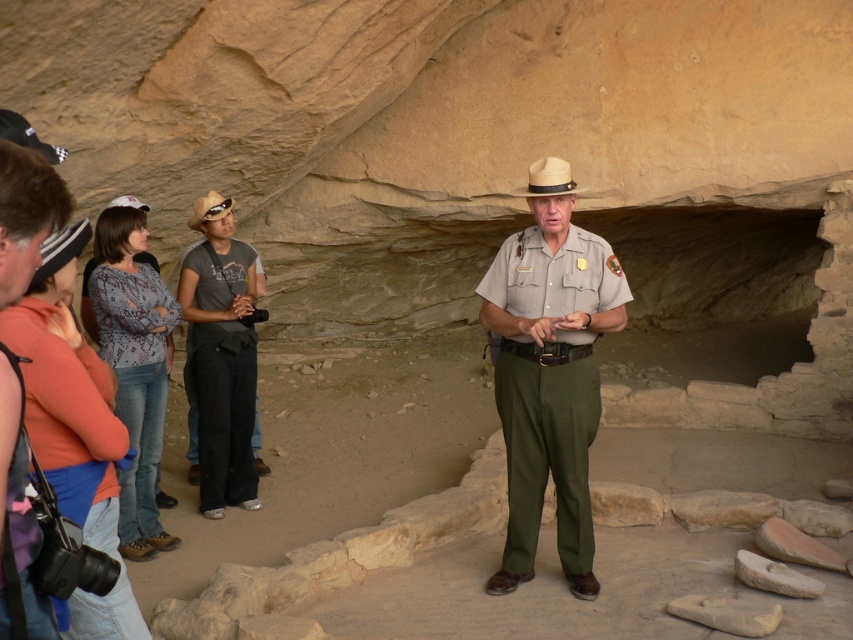
You are a photographer trying to capture a group photo of the khaki uniform at center and the gray cotton shirt at center. Which person should you position closer to the camera to ensure both fit in the frame?

The khaki uniform at center might be wider than gray cotton shirt at center, so you should position the khaki uniform at center closer to the camera to ensure both fit in the frame.